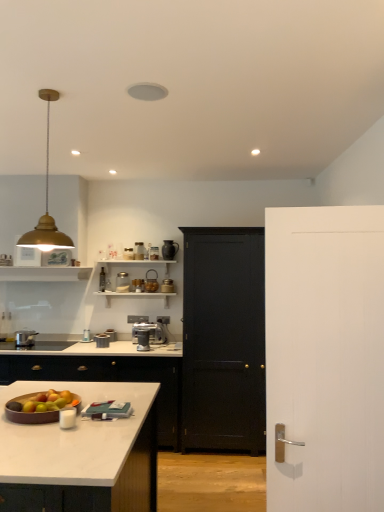
Find the location of a particular element. vacant space underneath gold metallic pendant light at upper left (from a real-world perspective) is located at coordinates (47, 402).